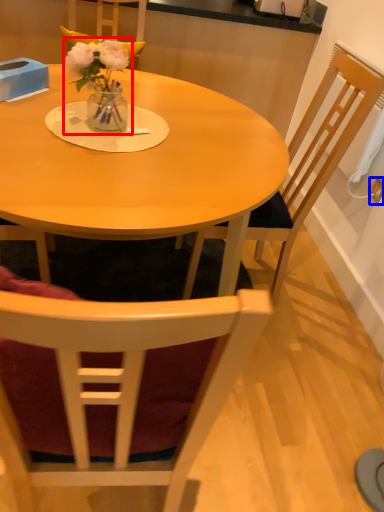
Question: Among these objects, which one is nearest to the camera, floral arrangement (highlighted by a red box) or power outlet (highlighted by a blue box)?

Choices:
 (A) floral arrangement
 (B) power outlet

Answer: (A)